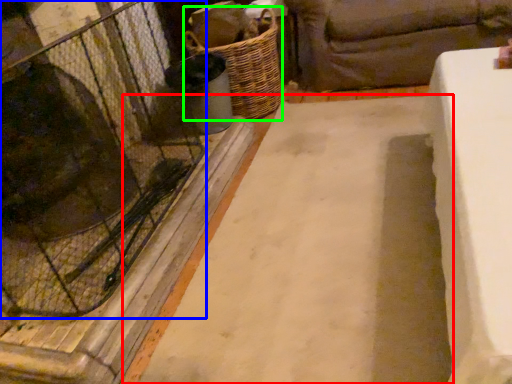
Question: Which object is positioned closest to foundation (highlighted by a red box)? Select from glass door (highlighted by a blue box) and basket (highlighted by a green box).

Choices:
 (A) glass door
 (B) basket

Answer: (A)